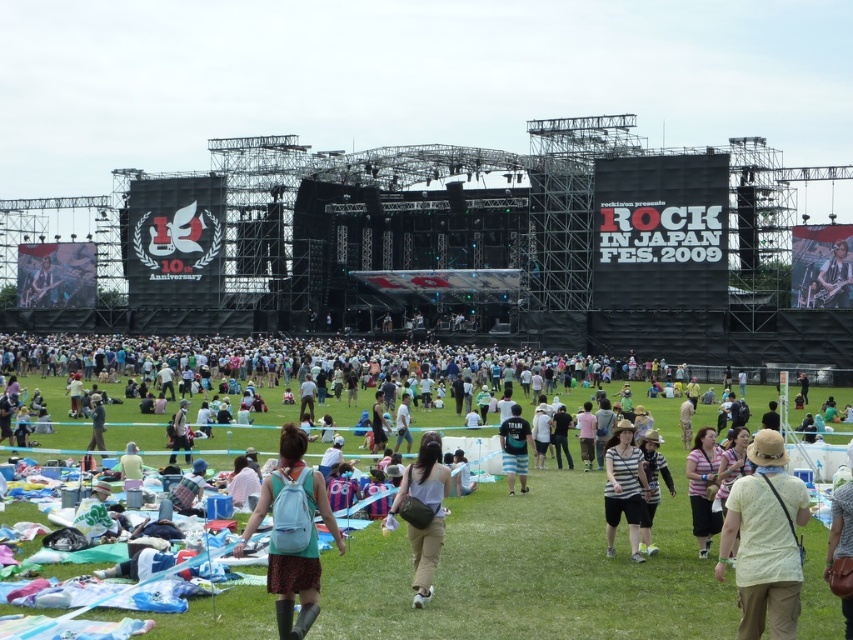
Question: Which of these objects is positioned closest to the light blue fabric backpack at center?

Choices:
 (A) striped fabric shirt at center
 (B) light beige cotton shirt at center
 (C) striped cotton shirt at center
 (D) light brown fabric pants at center

Answer: (D)

Question: Observing the image, what is the correct spatial positioning of light beige cotton shirt at center in reference to striped fabric shirt at center?

Choices:
 (A) left
 (B) right

Answer: (B)

Question: Among these points, which one is nearest to the camera?

Choices:
 (A) (704, 500)
 (B) (781, 458)

Answer: (B)

Question: Which point appears farthest from the camera in this image?

Choices:
 (A) (439, 461)
 (B) (508, 472)
 (C) (288, 595)

Answer: (B)

Question: Is light blue fabric backpack at center to the left of light brown fabric pants at center from the viewer's perspective?

Choices:
 (A) yes
 (B) no

Answer: (A)

Question: Is light beige cotton shirt at center below striped fabric shirt at center?

Choices:
 (A) no
 (B) yes

Answer: (B)